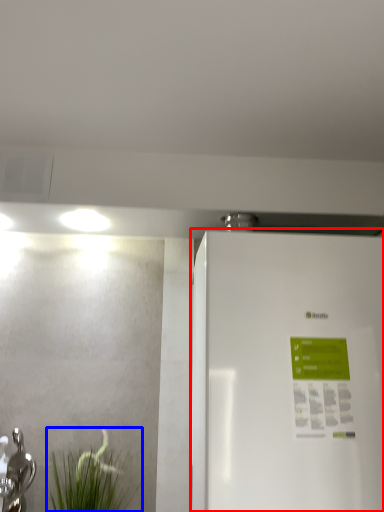
Question: Which point is closer to the camera, refrigerator (highlighted by a red box) or plant (highlighted by a blue box)?

Choices:
 (A) refrigerator
 (B) plant

Answer: (A)